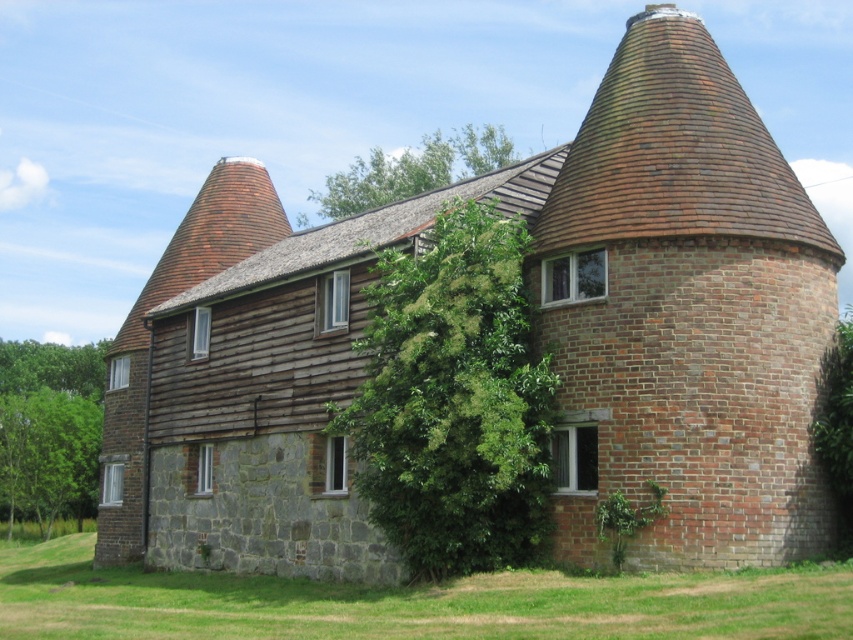
Question: Does green leafy tree at center have a smaller size compared to green leafy tree at lower left?

Choices:
 (A) no
 (B) yes

Answer: (B)

Question: Where is red brick chimney at center located in relation to green leafy tree at center in the image?

Choices:
 (A) left
 (B) right

Answer: (B)

Question: Which point appears farthest from the camera in this image?

Choices:
 (A) (798, 529)
 (B) (456, 138)

Answer: (B)

Question: Which point is closer to the camera?

Choices:
 (A) (421, 156)
 (B) (39, 483)
 (C) (144, 365)
 (D) (773, 278)

Answer: (D)

Question: From the image, what is the correct spatial relationship of red brick chimney at center in relation to green leafy tree at center?

Choices:
 (A) right
 (B) left

Answer: (A)

Question: Among these points, which one is farthest from the camera?

Choices:
 (A) (438, 168)
 (B) (680, 301)

Answer: (A)